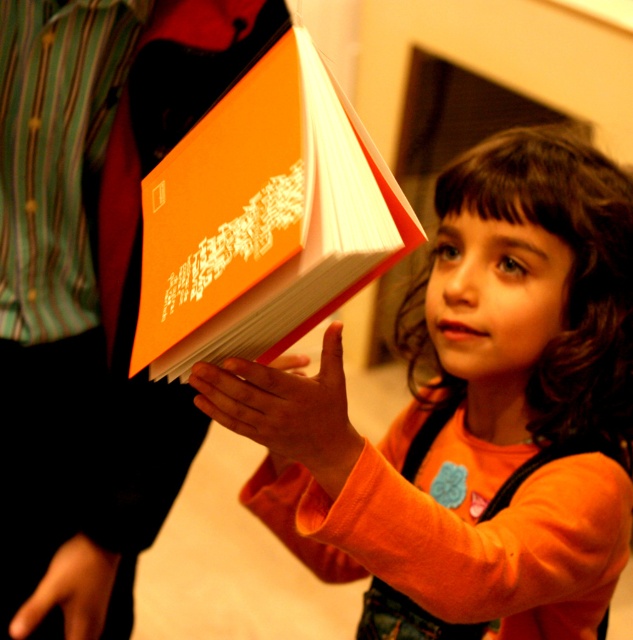
Wait, the objects list has two entries that are almost the same. The first is matte orange book at center and the second is orange matte book at center. The objects description says the first is taller than the second. But they are the same object? Or are they different? Maybe a typo? Let me check the rules again. The user might have made a mistake in the object labels. But according to the rules, I must use the object labels exactly as given. So even if they are duplicates, I have to treat them as separate

The matte orange book at center is taller than the orange matte book at center.

You are a librarian organizing books on a shelf. You have two books in front of you, the matte orange book at center and the orange matte book at center. Which one has a greater width?

The matte orange book at center has a greater width than the orange matte book at center.